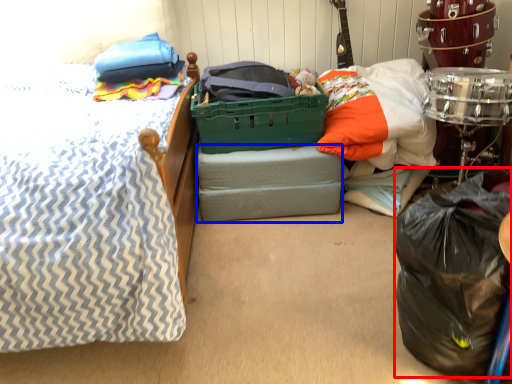
Question: Which object is further to the camera taking this photo, garbage (highlighted by a red box) or storage box (highlighted by a blue box)?

Choices:
 (A) garbage
 (B) storage box

Answer: (B)